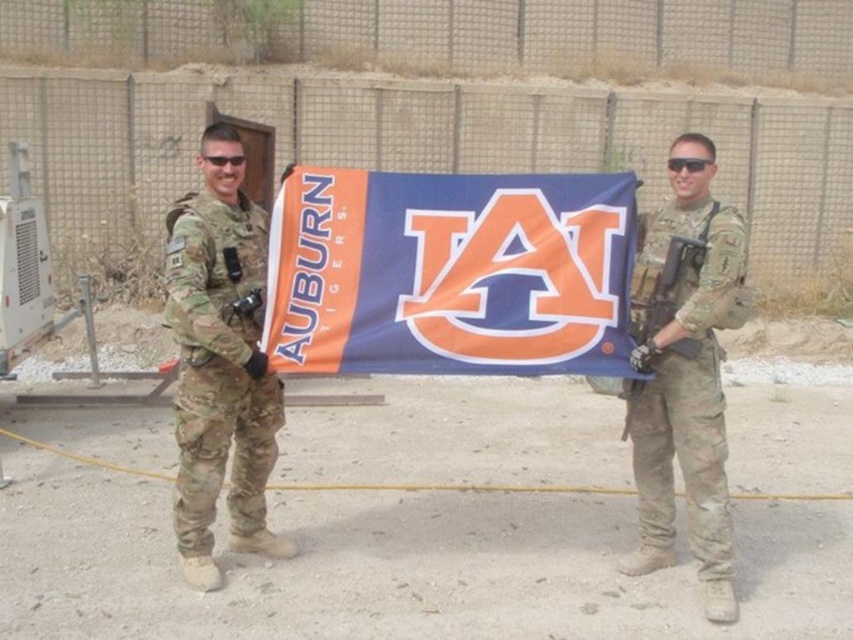
How much distance is there between blue fabric flag at center and camouflage fabric uniform at right?

They are 24.30 inches apart.

Does point (515, 193) come closer to viewer compared to point (704, 202)?

Yes, point (515, 193) is closer to viewer.

The height and width of the screenshot is (640, 853). I want to click on blue fabric flag at center, so click(x=450, y=273).

Does blue fabric flag at center have a greater width compared to matte black rifle at right?

Yes, blue fabric flag at center is wider than matte black rifle at right.

Does blue fabric flag at center lie in front of matte black rifle at right?

Yes, blue fabric flag at center is closer to the viewer.

Where is `blue fabric flag at center`? Image resolution: width=853 pixels, height=640 pixels. blue fabric flag at center is located at coordinates (450, 273).

Does point (263, 381) lie in front of point (630, 412)?

Yes, point (263, 381) is closer to viewer.

Between point (276, 394) and point (703, 252), which one is positioned behind?

The point (276, 394) is behind.

Identify the location of camouflage fabric uniform at left. (219, 364).